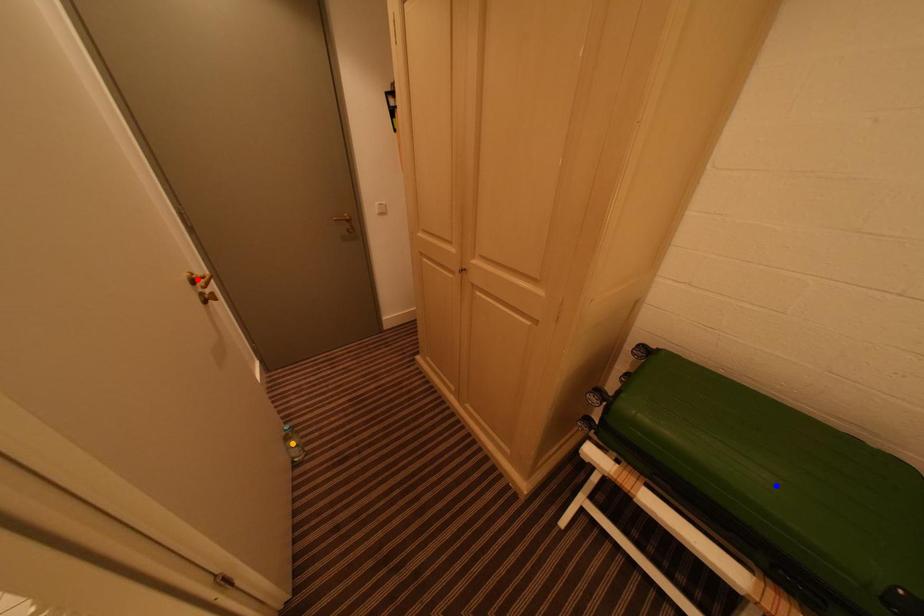
Order these from nearest to farthest:
orange point
blue point
red point

orange point → red point → blue point